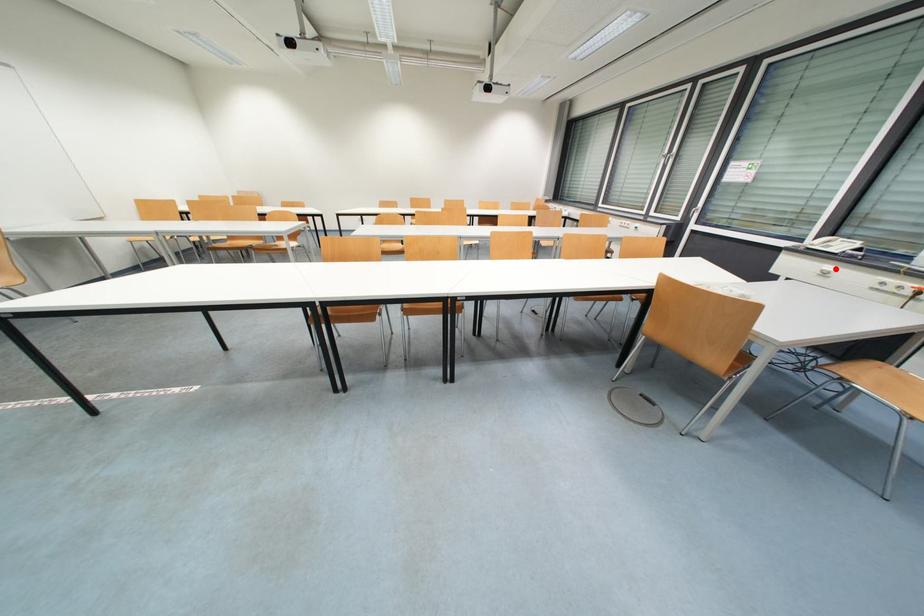
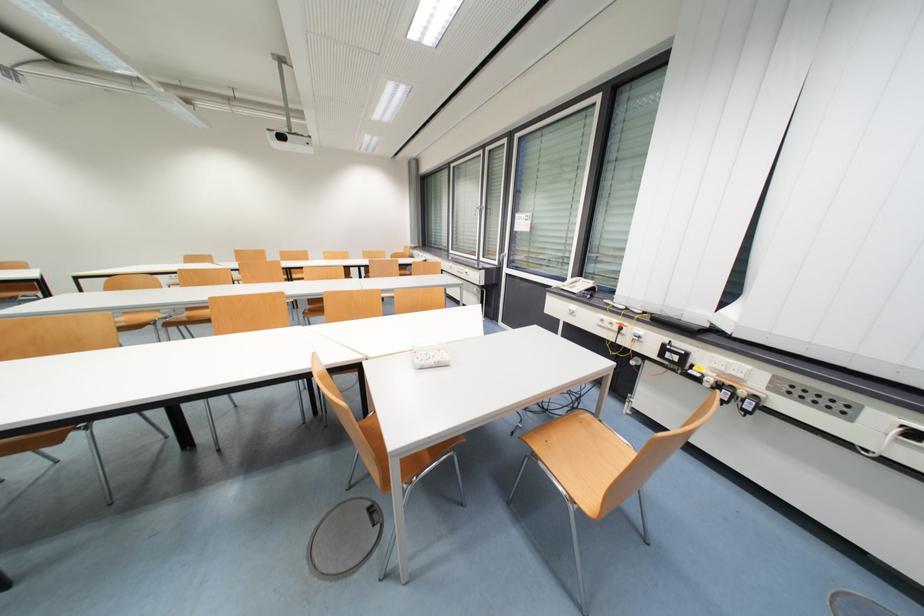
Question: I am providing you with two images of the same scene from different viewpoints. Image1 has a red point marked. In image2, the corresponding 3D location appears at what relative position? Reply with the corresponding letter.

Choices:
 (A) Closer
 (B) Farther

Answer: (A)